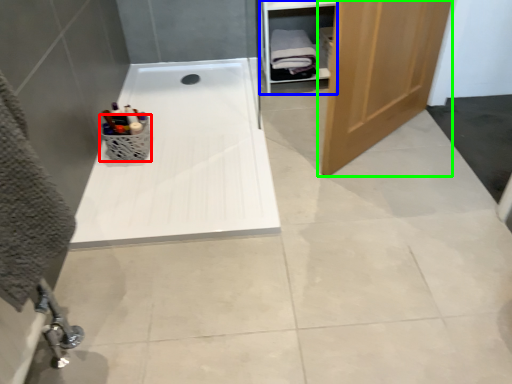
Question: Based on their relative distances, which object is nearer to basket (highlighted by a red box)? Choose from cabinet (highlighted by a blue box) and door (highlighted by a green box).

Choices:
 (A) cabinet
 (B) door

Answer: (B)